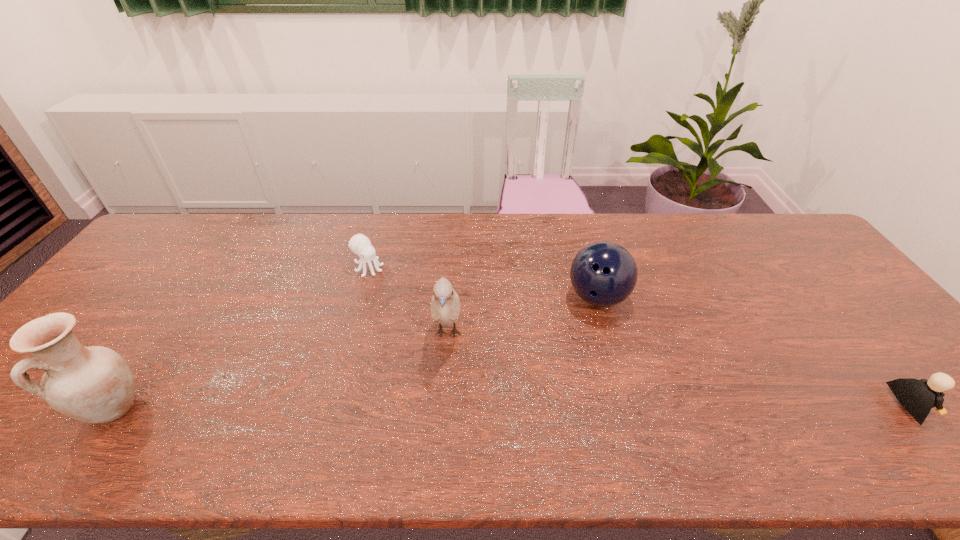
Find the location of a particular element. The image size is (960, 540). pottery is located at coordinates (94, 384).

Where is `Lego`? This screenshot has width=960, height=540. Lego is located at coordinates (918, 397).

What are the coordinates of `the second object from right to left` in the screenshot? It's located at [603, 273].

Locate an element on the screen. This screenshot has height=540, width=960. bowling ball is located at coordinates (603, 273).

Where is `bird`? bird is located at coordinates (445, 305).

Where is `octopus`? The image size is (960, 540). octopus is located at coordinates (360, 244).

Where is `vacant space located 0.100m on the right of the leftmost object`? The image size is (960, 540). vacant space located 0.100m on the right of the leftmost object is located at coordinates (189, 407).

Where is `free space located 0.060m on the front-facing side of the rightmost object`? This screenshot has width=960, height=540. free space located 0.060m on the front-facing side of the rightmost object is located at coordinates (952, 406).

You are a GUI agent. You are given a task and a screenshot of the screen. Output one action in this format:
    pyautogui.click(x=<x>, y=<y>)
    Task: Click on the free location located on the surface of the fourth object from left to right near the finger holes
    The height and width of the screenshot is (540, 960).
    Given the screenshot: What is the action you would take?
    pyautogui.click(x=598, y=336)

Locate an element on the screen. Image resolution: width=960 pixels, height=540 pixels. blank area located on the surface of the fourth object from left to right near the finger holes is located at coordinates (600, 407).